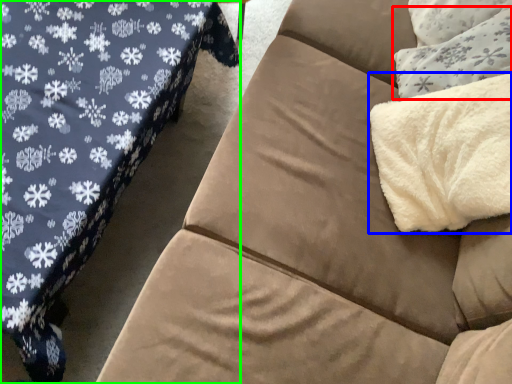
Question: Which is farther away from throw pillow (highlighted by a red box)? blanket (highlighted by a blue box) or studio couch (highlighted by a green box)?

Choices:
 (A) blanket
 (B) studio couch

Answer: (B)